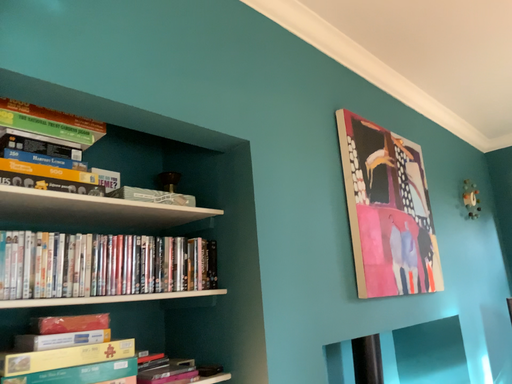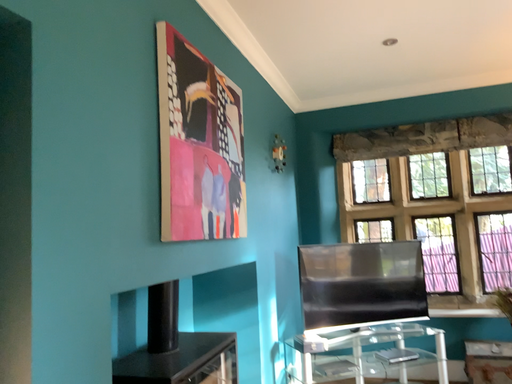
Question: How did the camera likely rotate when shooting the video?

Choices:
 (A) rotated upward
 (B) rotated downward

Answer: (B)